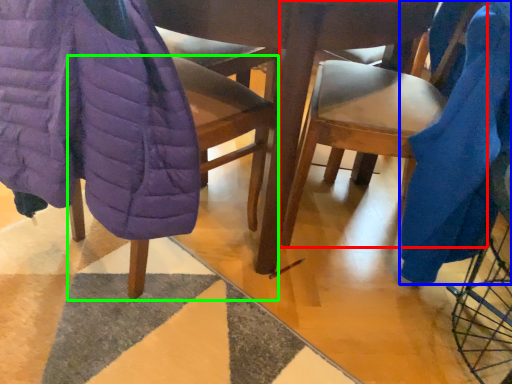
Question: Estimate the real-world distances between objects in this image. Which object is closer to chair (highlighted by a red box), blanket (highlighted by a blue box) or chair (highlighted by a green box)?

Choices:
 (A) blanket
 (B) chair

Answer: (A)